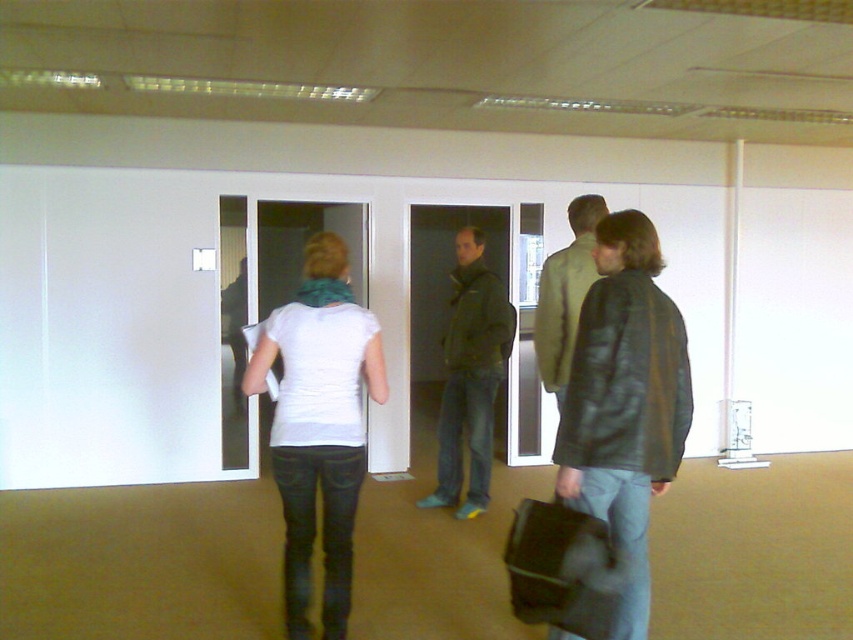
Who is taller, white matte shirt at center or light brown leather jacket at center?

With more height is white matte shirt at center.

Does white matte shirt at center come in front of light brown leather jacket at center?

Yes.

Locate an element on the screen. Image resolution: width=853 pixels, height=640 pixels. white matte shirt at center is located at coordinates (318, 426).

Who is positioned more to the right, white matte shirt at center or dark green jacket at center?

dark green jacket at center

Does point (309, 364) come behind point (459, 253)?

No.

What are the coordinates of `white matte shirt at center` in the screenshot? It's located at (318, 426).

Is point (606, 216) more distant than point (579, 216)?

No, (606, 216) is in front of (579, 216).

Between point (628, 280) and point (547, 292), which one is positioned behind?

Positioned behind is point (547, 292).

The image size is (853, 640). In order to click on leather jacket at right in this screenshot , I will do `click(625, 401)`.